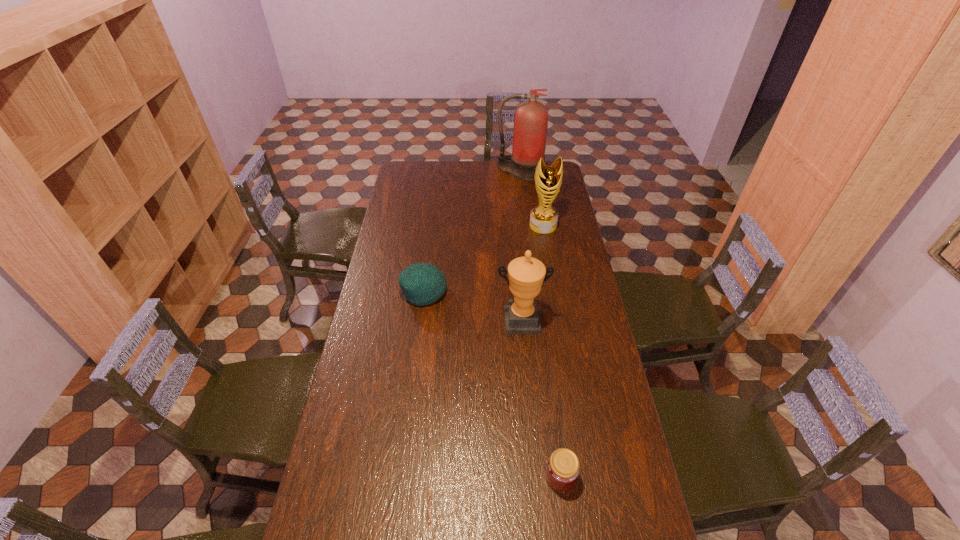
The image size is (960, 540). In order to click on the tallest object in this screenshot , I will do `click(531, 117)`.

Where is `fire extinguisher`? This screenshot has width=960, height=540. fire extinguisher is located at coordinates (531, 117).

Locate an element on the screen. the second farthest object is located at coordinates (543, 218).

The width and height of the screenshot is (960, 540). I want to click on the nearer award, so click(526, 275).

Where is `beanie`? The image size is (960, 540). beanie is located at coordinates (422, 283).

Find the location of a particular element. the fourth tallest object is located at coordinates (422, 283).

Locate an element on the screen. This screenshot has height=540, width=960. the nearest object is located at coordinates (563, 467).

Locate an element on the screen. Image resolution: width=960 pixels, height=540 pixels. jam is located at coordinates (563, 467).

I want to click on free space located 0.330m at the nozzle of the fire extinguisher, so click(x=525, y=216).

This screenshot has height=540, width=960. In order to click on vacant space positioned on the front-facing side of the farther award in this screenshot , I will do point(549,259).